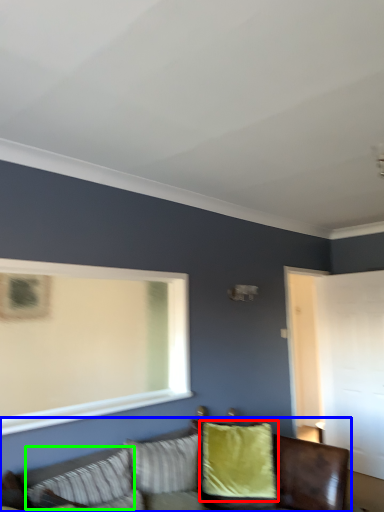
Question: Which is farther away from pillow (highlighted by a red box)? studio couch (highlighted by a blue box) or pillow (highlighted by a green box)?

Choices:
 (A) studio couch
 (B) pillow

Answer: (B)